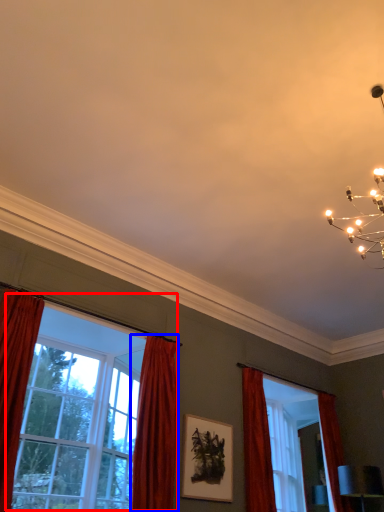
Question: Which object is further to the camera taking this photo, window (highlighted by a red box) or curtain (highlighted by a blue box)?

Choices:
 (A) window
 (B) curtain

Answer: (B)